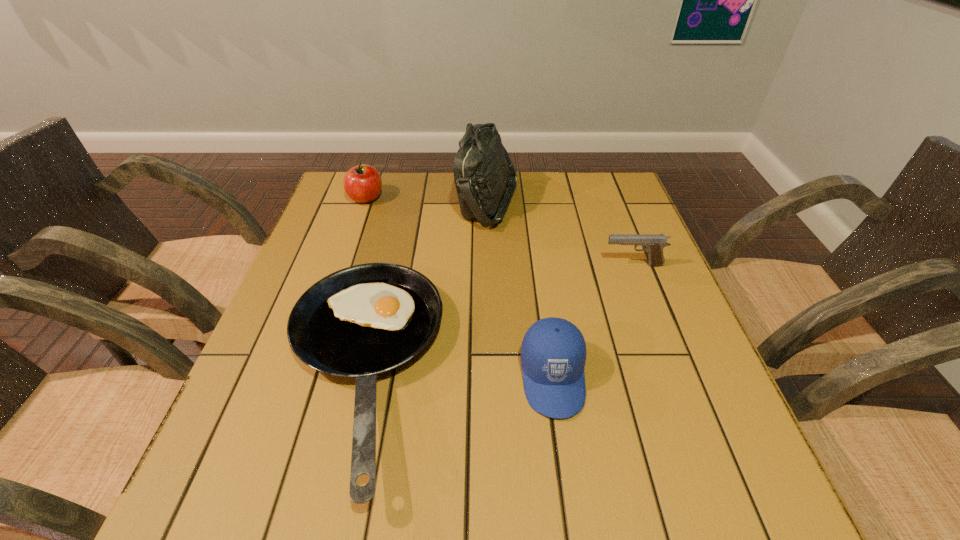
Identify the location of vacant point that satisfies the following two spatial constraints: 1. at the barrel of the pistol; 2. on the front-facing side of the cap. This screenshot has width=960, height=540. (676, 377).